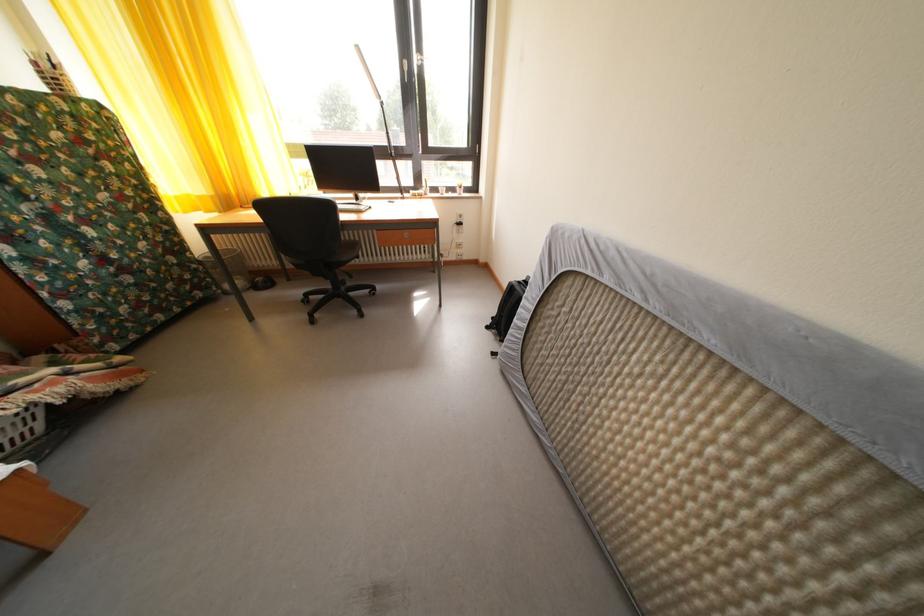
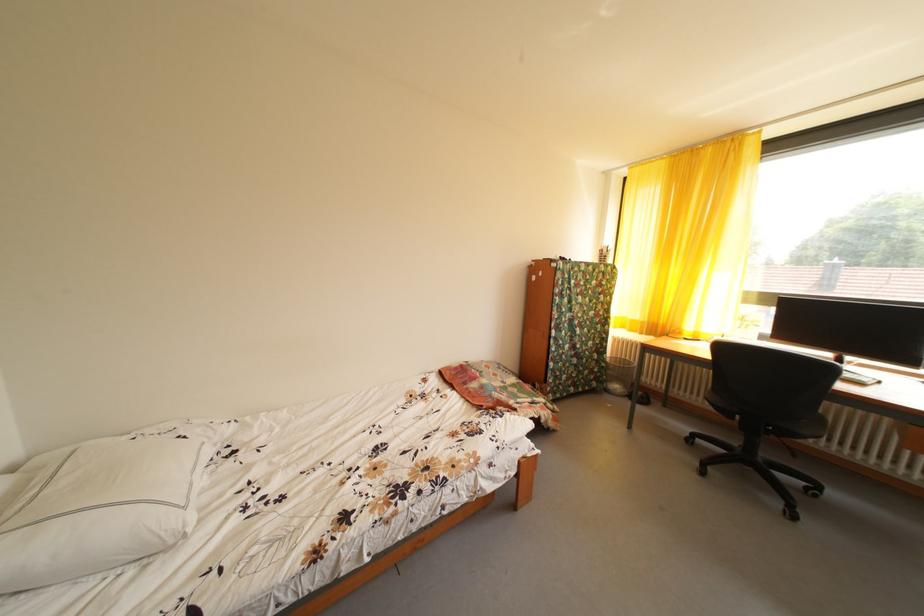
Question: The first image is from the beginning of the video and the second image is from the end. How did the camera likely rotate when shooting the video?

Choices:
 (A) Left
 (B) Right
 (C) Up
 (D) Down

Answer: (A)